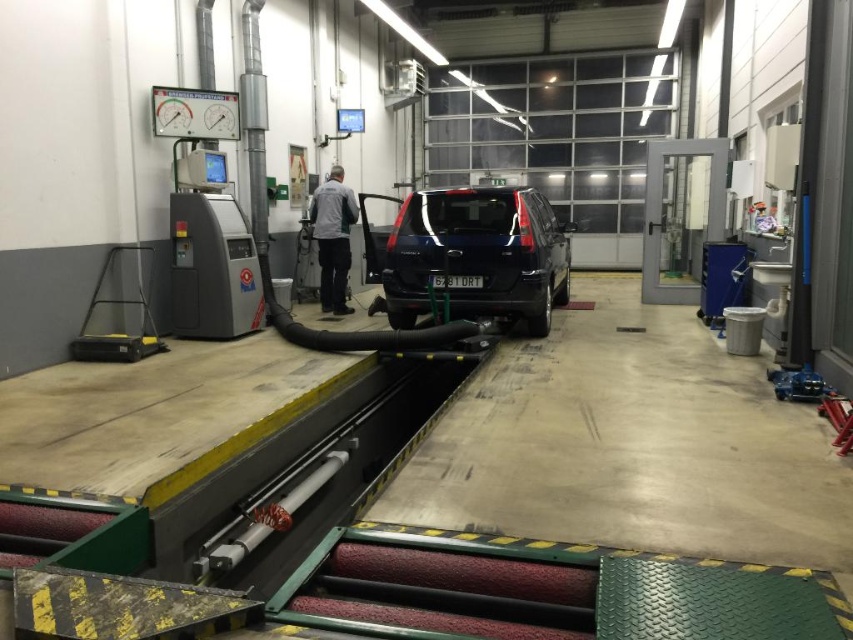
You are a mechanic working in the garage. You need to access the gray fabric jacket at center to retrieve a tool. However, the glossy black suv at center is blocking your path. Can you move the jacket without moving the SUV?

The glossy black suv at center is in front of the gray fabric jacket at center, so the SUV is blocking the jacket. You would need to move the SUV to access the jacket.